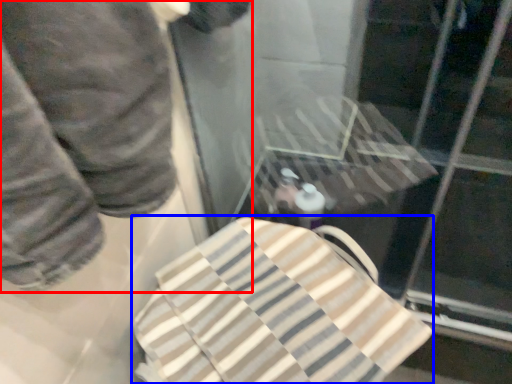
Question: Among these objects, which one is nearest to the camera, person (highlighted by a red box) or beach towel (highlighted by a blue box)?

Choices:
 (A) person
 (B) beach towel

Answer: (A)